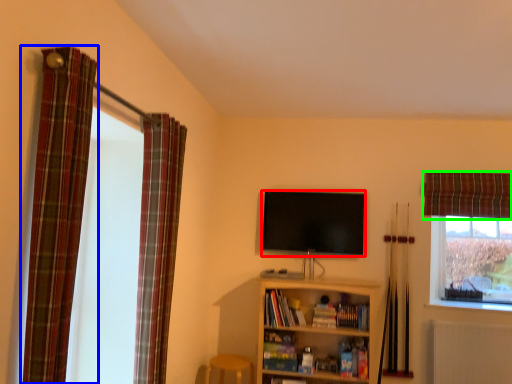
Question: Considering the real-world distances, which object is closest to television (highlighted by a red box)? curtain (highlighted by a blue box) or curtain (highlighted by a green box).

Choices:
 (A) curtain
 (B) curtain

Answer: (B)